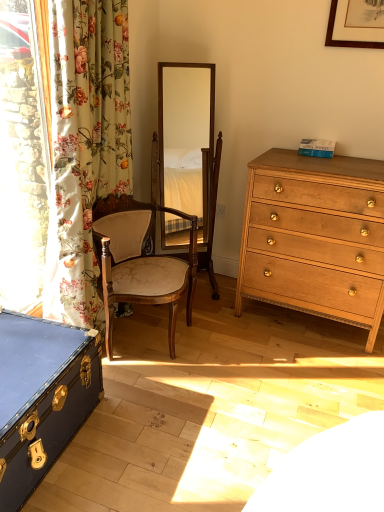
The width and height of the screenshot is (384, 512). Identify the location of vacant point above light brown wooden chest of drawers at right (from a real-world perspective). (345, 161).